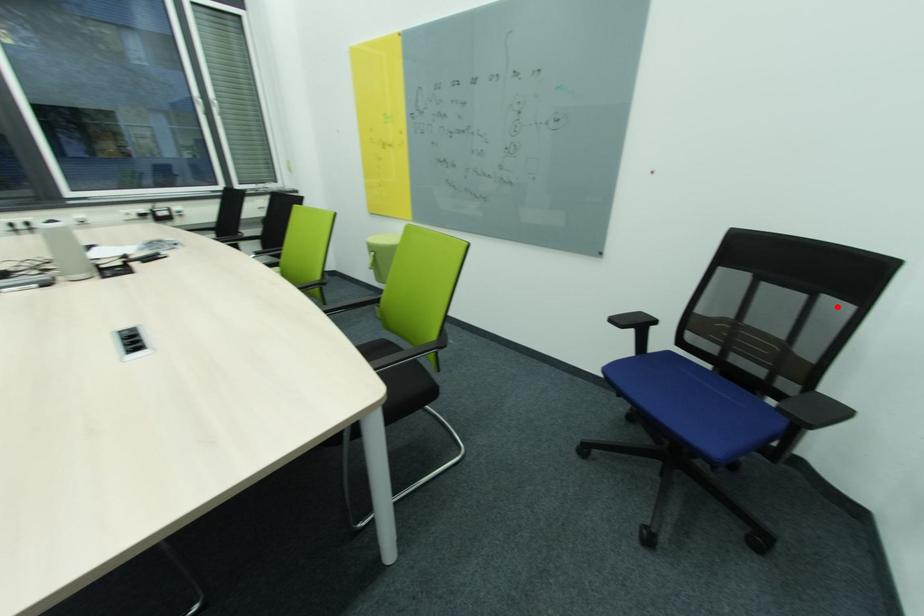
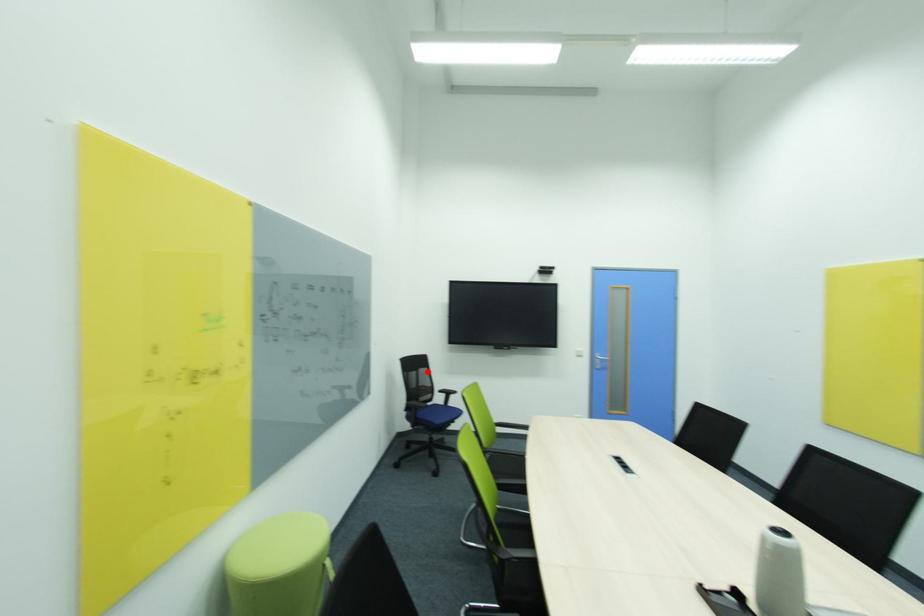
I am providing you with two images of the same scene from different viewpoints. A red point is marked on the first image and another point is marked on the second image. Is the marked point in image1 the same physical position as the marked point in image2?

Yes